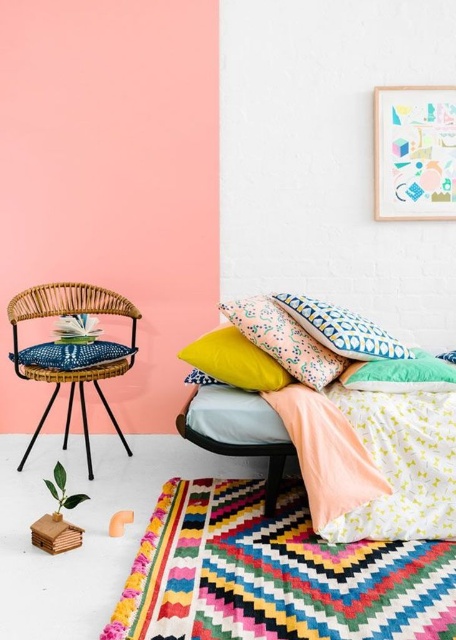
Who is positioned more to the left, rattan chair at left or patterned fabric pillow at center?

rattan chair at left is more to the left.

Who is more forward, (36, 298) or (257, 305)?

Positioned in front is point (257, 305).

From the picture: Who is more forward, (x=108, y=410) or (x=321, y=371)?

Positioned in front is point (x=321, y=371).

Find the location of a particular element. rattan chair at left is located at coordinates (72, 348).

Does multicolored woven quilt at lower center appear over yellow fabric quilt at center?

No.

Which is in front, point (440, 634) or point (429, 458)?

Positioned in front is point (440, 634).

Find the location of a particular element. This screenshot has width=456, height=640. multicolored woven quilt at lower center is located at coordinates (274, 573).

You are a GUI agent. You are given a task and a screenshot of the screen. Output one action in this format:
    pyautogui.click(x=<x>, y=<y>)
    Task: Click on the multicolored woven quilt at lower center
    This screenshot has width=456, height=640.
    Given the screenshot: What is the action you would take?
    pyautogui.click(x=274, y=573)

Who is higher up, yellow matte pillow at center or green fabric pillow at center?

yellow matte pillow at center

Find the location of `yellow matte pillow at center`. yellow matte pillow at center is located at coordinates (234, 360).